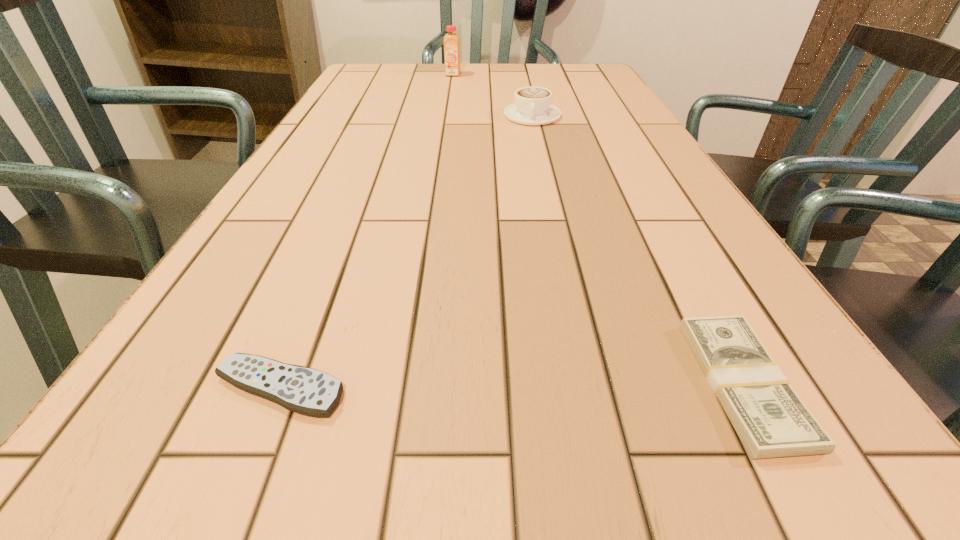
At what (x,y) coordinates should I click in order to perform the action: click on object that is the third closest to the third object from left to right. Please return your answer as a coordinate pair (x, y). This screenshot has width=960, height=540. Looking at the image, I should click on (308, 391).

I want to click on vacant space that satisfies the following two spatial constraints: 1. on the front and back of the tallest object; 2. on the right side of the rightmost object, so click(407, 384).

The height and width of the screenshot is (540, 960). I want to click on free spot that satisfies the following two spatial constraints: 1. on the back side of the rightmost object; 2. on the left side of the leftmost object, so click(x=281, y=384).

Locate an element on the screen. This screenshot has height=540, width=960. free space that satisfies the following two spatial constraints: 1. on the front and back of the tallest object; 2. on the right side of the dollar is located at coordinates (407, 384).